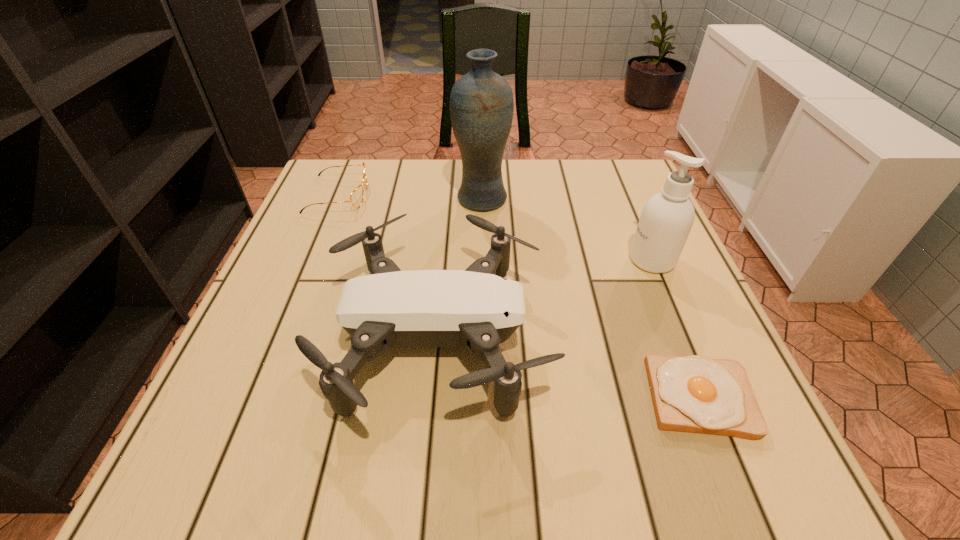
The image size is (960, 540). I want to click on vacant region located on the camera side of the drone, so click(x=629, y=338).

Where is `free region located 0.390m on the front-facing side of the second shortest object`? The width and height of the screenshot is (960, 540). free region located 0.390m on the front-facing side of the second shortest object is located at coordinates (517, 195).

I want to click on free region located 0.370m on the left of the shortest object, so click(x=421, y=397).

Locate an element on the screen. This screenshot has width=960, height=540. vase located in the far edge section of the desktop is located at coordinates (481, 102).

Locate an element on the screen. This screenshot has height=540, width=960. spectacles located at the far edge is located at coordinates (356, 198).

Find the location of a particular element. The image size is (960, 540). drone that is at the near edge is located at coordinates (477, 308).

Find the location of `toast present at the near edge`. toast present at the near edge is located at coordinates (695, 394).

Find the location of `object that is positioned at the left edge`. object that is positioned at the left edge is located at coordinates (356, 198).

Where is `cleansing agent that is positioned at the right edge`? cleansing agent that is positioned at the right edge is located at coordinates (667, 217).

Locate an element on the screen. This screenshot has height=540, width=960. toast present at the right edge is located at coordinates (695, 394).